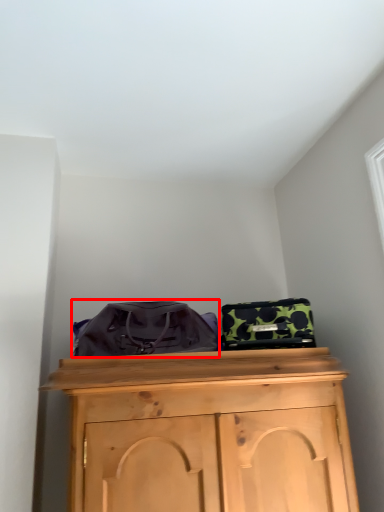
Question: From the image's perspective, where is messenger bag (annotated by the red box) located in relation to luggage in the image?

Choices:
 (A) below
 (B) above

Answer: (B)